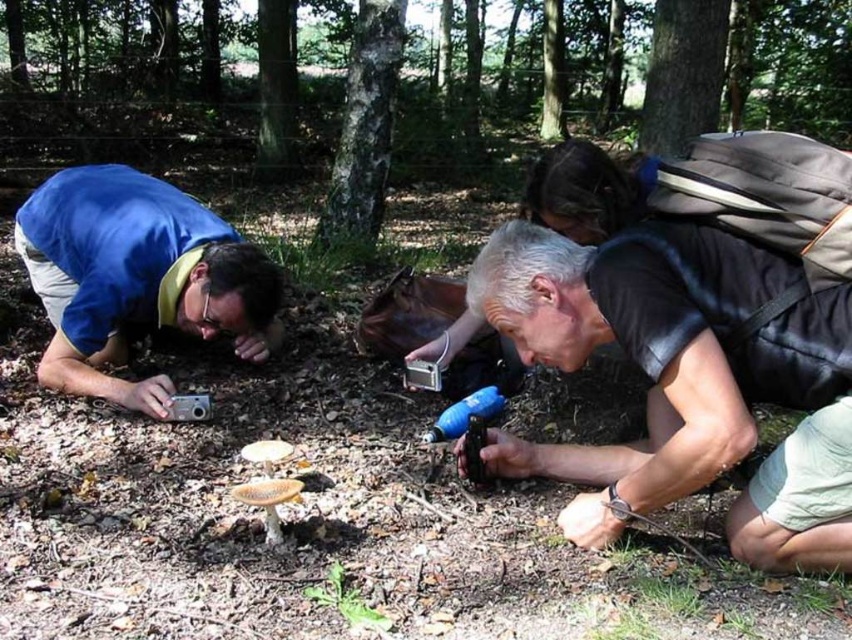
You are a researcher in the forest and need to locate the black matte camera at lower right. Which object is it positioned relative to the green leafy plant at center?

The black matte camera at lower right is positioned to the right of the green leafy plant at center.